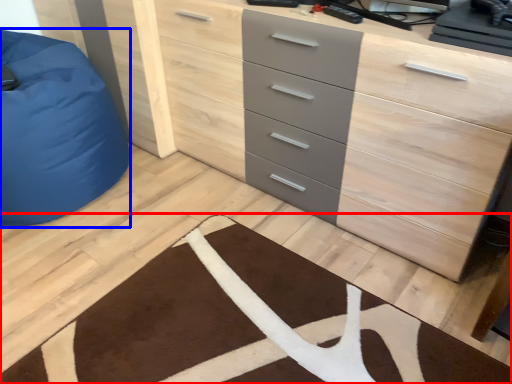
Question: Among these objects, which one is farthest to the camera, doormat (highlighted by a red box) or furniture (highlighted by a blue box)?

Choices:
 (A) doormat
 (B) furniture

Answer: (B)